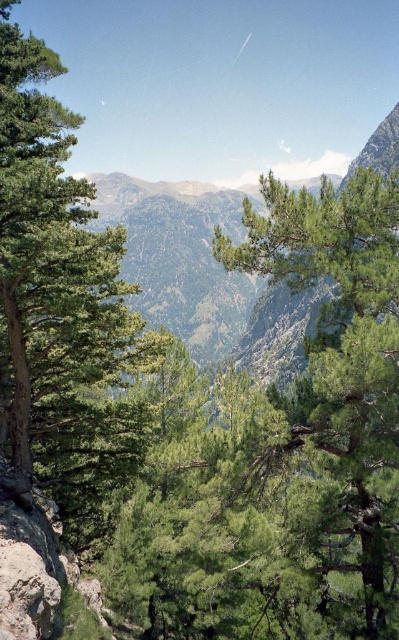
Question: Which point is farther to the camera?

Choices:
 (A) (268, 204)
 (B) (49, 378)

Answer: (B)

Question: Considering the relative positions of green leafy tree at center and green leafy tree at left in the image provided, where is green leafy tree at center located with respect to green leafy tree at left?

Choices:
 (A) above
 (B) below

Answer: (B)

Question: Does green leafy tree at center have a smaller size compared to green leafy tree at left?

Choices:
 (A) no
 (B) yes

Answer: (A)

Question: Which object is closer to the camera taking this photo?

Choices:
 (A) green leafy tree at center
 (B) green leafy tree at left

Answer: (A)

Question: Where is green leafy tree at center located in relation to green leafy tree at left in the image?

Choices:
 (A) below
 (B) above

Answer: (A)

Question: Which point is farther to the camera?

Choices:
 (A) (323, 467)
 (B) (69, 317)

Answer: (B)